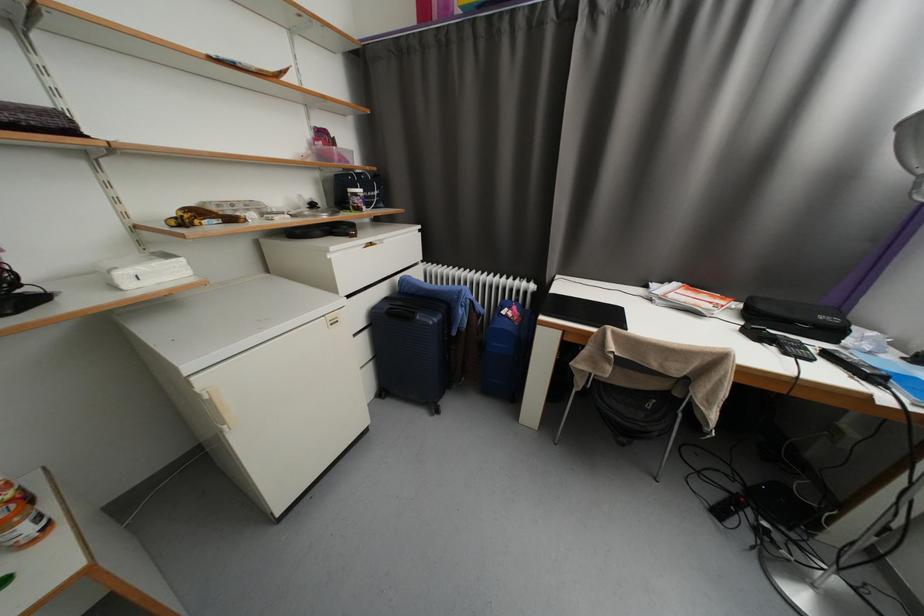
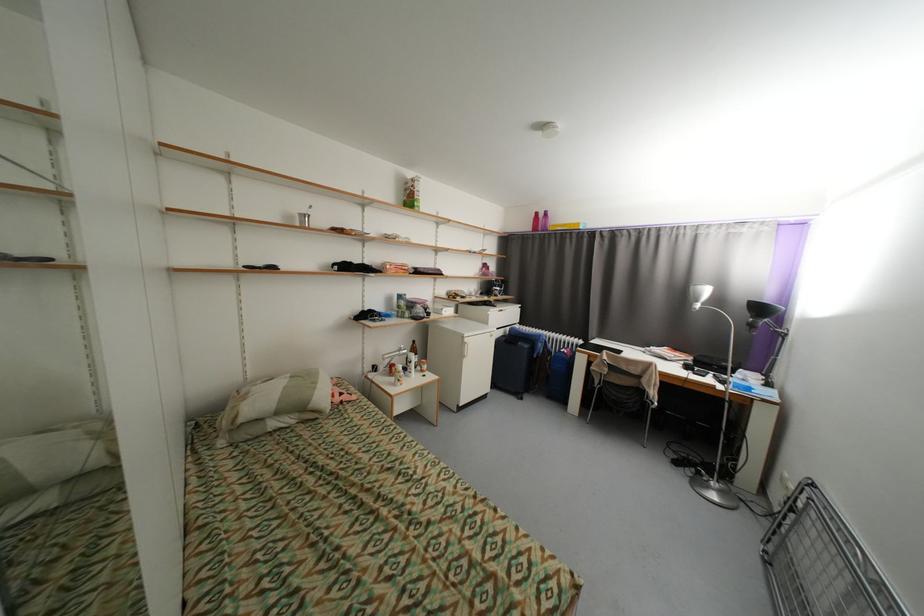
Question: The images are taken continuously from a first-person perspective. In which direction are you moving?

Choices:
 (A) Left
 (B) Right
 (C) Forward
 (D) Backward

Answer: (D)